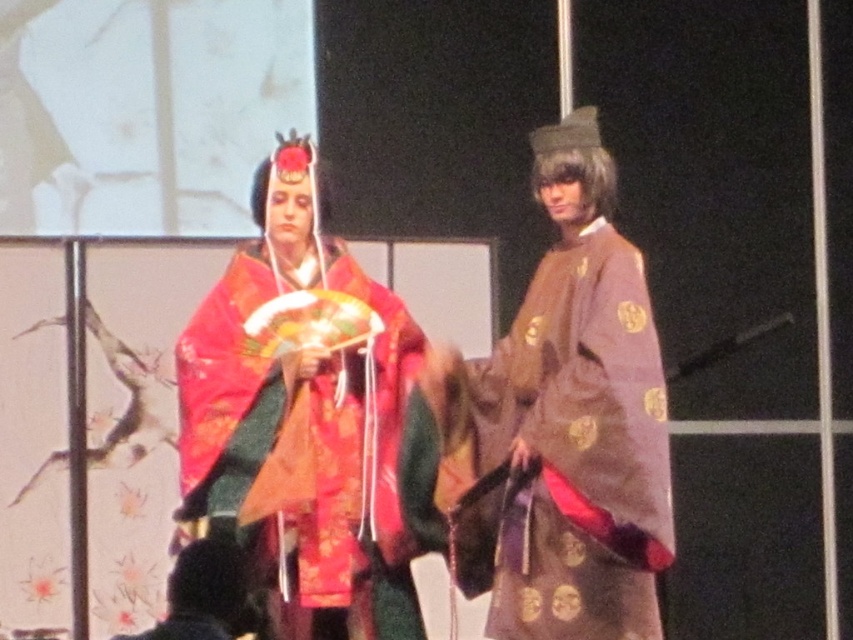
Question: Does matte red kimono at center have a lesser width compared to matte brown robe at center?

Choices:
 (A) no
 (B) yes

Answer: (A)

Question: Which object is positioned closest to the silky red kimono at center?

Choices:
 (A) matte red kimono at center
 (B) matte brown robe at center

Answer: (A)

Question: Which object is closer to the camera taking this photo?

Choices:
 (A) matte brown robe at center
 (B) matte red kimono at center
 (C) silky red kimono at center

Answer: (B)

Question: Which point appears farthest from the camera in this image?

Choices:
 (A) (547, 470)
 (B) (602, 429)
 (C) (288, 248)

Answer: (C)

Question: Can you confirm if matte red kimono at center is bigger than matte brown robe at center?

Choices:
 (A) no
 (B) yes

Answer: (B)

Question: Is matte red kimono at center above silky red kimono at center?

Choices:
 (A) yes
 (B) no

Answer: (B)